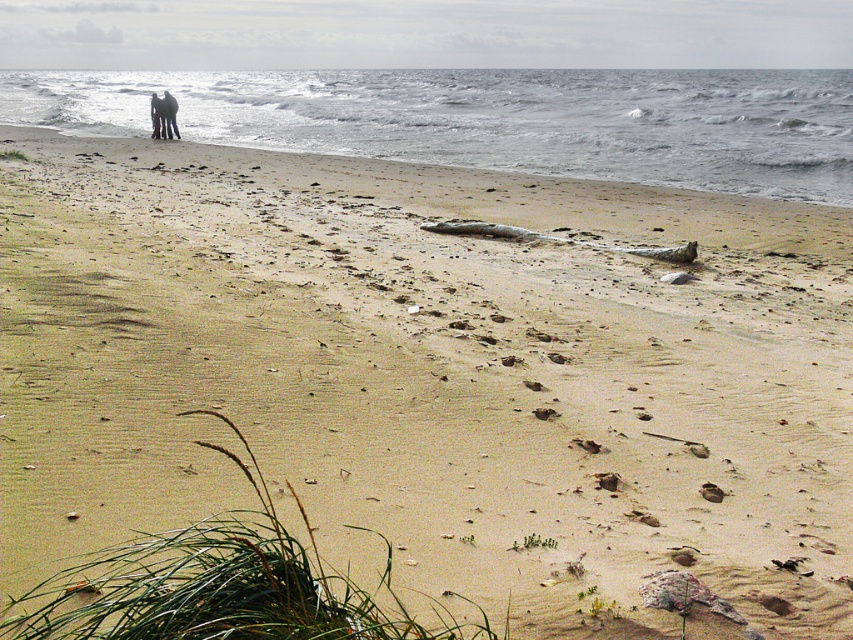
Who is more forward, [381,145] or [151,100]?

Point [381,145]

Can you confirm if gray water at upper left is positioned to the right of dark gray fabric pants at upper left?

Indeed, gray water at upper left is positioned on the right side of dark gray fabric pants at upper left.

Is point (532, 122) less distant than point (161, 134)?

No, it is not.

This screenshot has width=853, height=640. What are the coordinates of `gray water at upper left` in the screenshot? It's located at (492, 120).

Looking at this image, does dark clothing couple at upper left appear under dark gray fabric pants at upper left?

Actually, dark clothing couple at upper left is above dark gray fabric pants at upper left.

Is dark clothing couple at upper left in front of dark gray fabric pants at upper left?

Yes.

Which is in front, point (169, 93) or point (154, 115)?

Point (154, 115) is in front.

Locate an element on the screen. The width and height of the screenshot is (853, 640). dark clothing couple at upper left is located at coordinates (163, 115).

Can you confirm if gray water at upper left is thinner than dark clothing couple at upper left?

No.

Does gray water at upper left appear on the left side of dark clothing couple at upper left?

Incorrect, gray water at upper left is not on the left side of dark clothing couple at upper left.

At what (x,y) coordinates should I click in order to perform the action: click on gray water at upper left. Please return your answer as a coordinate pair (x, y). Image resolution: width=853 pixels, height=640 pixels. Looking at the image, I should click on (492, 120).